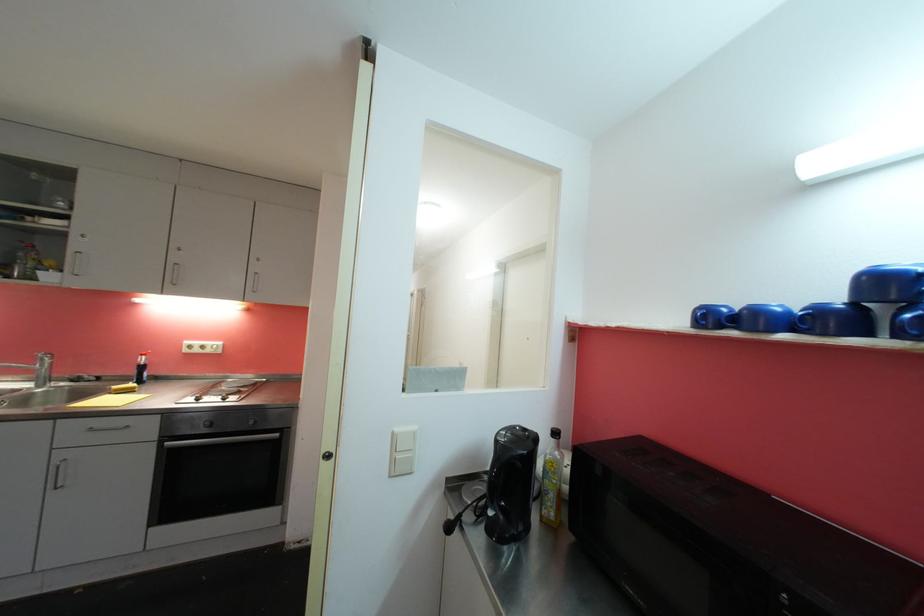
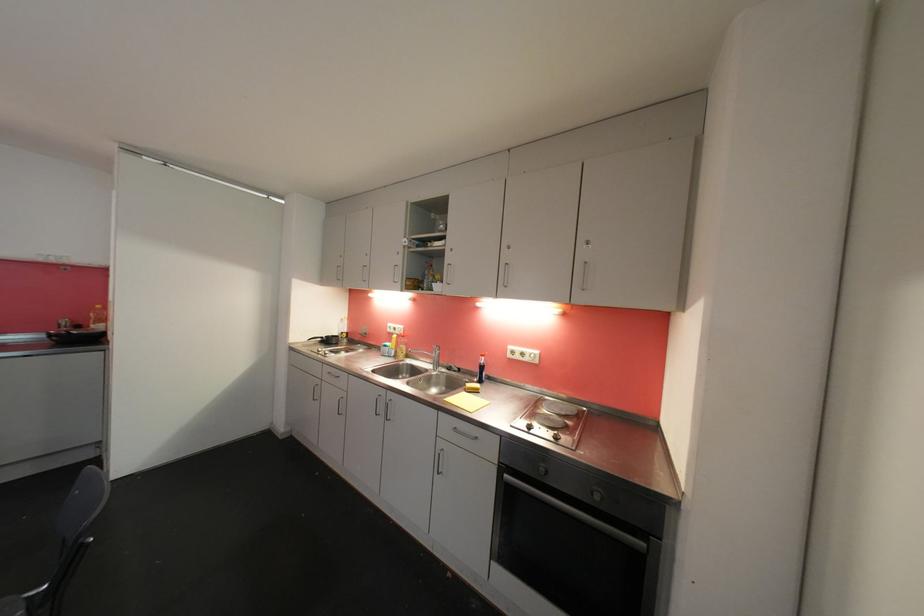
In the second image, find the point that corresponds to the point at 140,375 in the first image.

(482, 373)